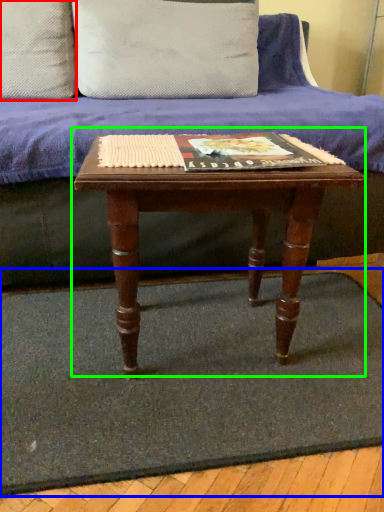
Question: Which is nearer to the pillow (highlighted by a red box)? doormat (highlighted by a blue box) or table (highlighted by a green box).

Choices:
 (A) doormat
 (B) table

Answer: (B)